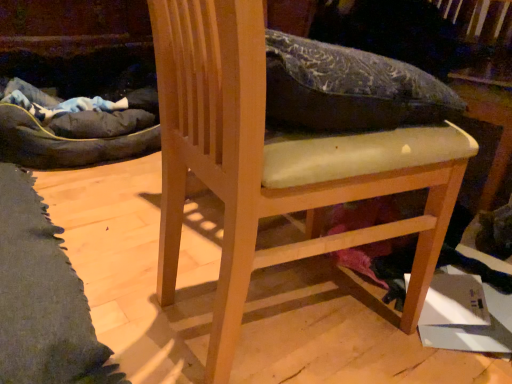
Find the location of a particular element. The width and height of the screenshot is (512, 384). free space to the left of white cardboard box at lower right is located at coordinates (366, 327).